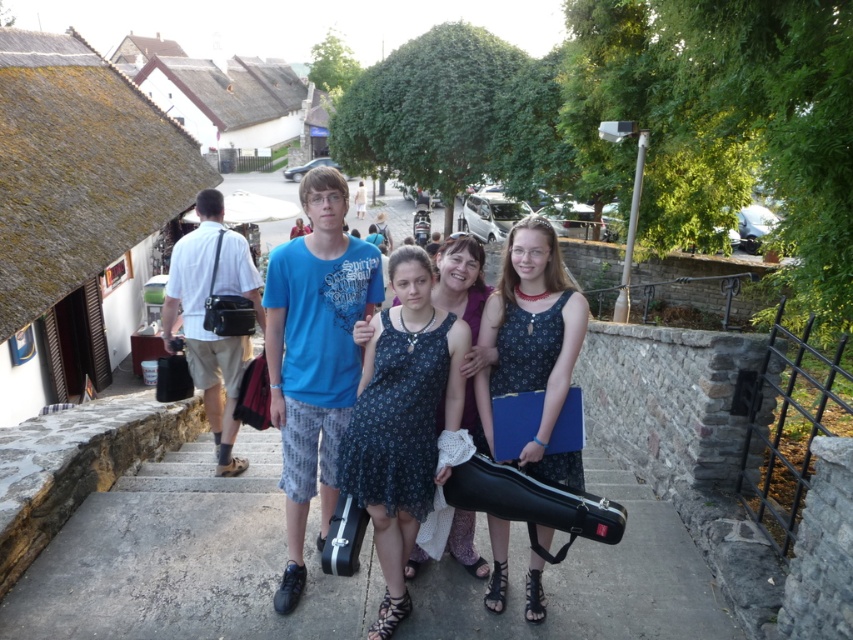
You are a photographer trying to capture a photo of the dark blue floral dress at center and the matte black guitar case at center. Which object should you focus on first if you want to ensure both are in sharp focus?

The dark blue floral dress at center is located below the matte black guitar case at center. Since the dress is lower, you should focus on the matte black guitar case at center first to ensure both are in sharp focus.

You are standing on the stone staircase in the village and want to move towards the closest point between point (x=416, y=260) and point (x=486, y=422). Which point should you walk towards?

Point (x=416, y=260) is closer to the viewer than point (x=486, y=422), so you should walk towards point (x=416, y=260).